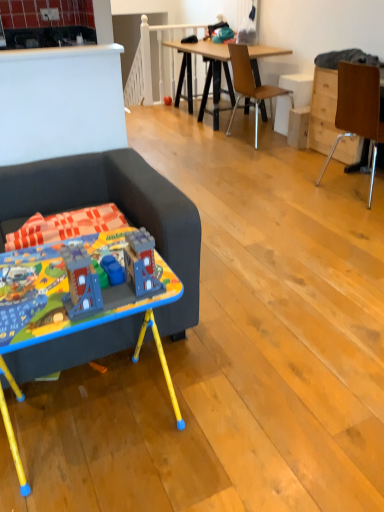
Find the location of `free spot behind wooden chair at right, which is counted as the second chair, starting from the left`. free spot behind wooden chair at right, which is counted as the second chair, starting from the left is located at coordinates (316, 167).